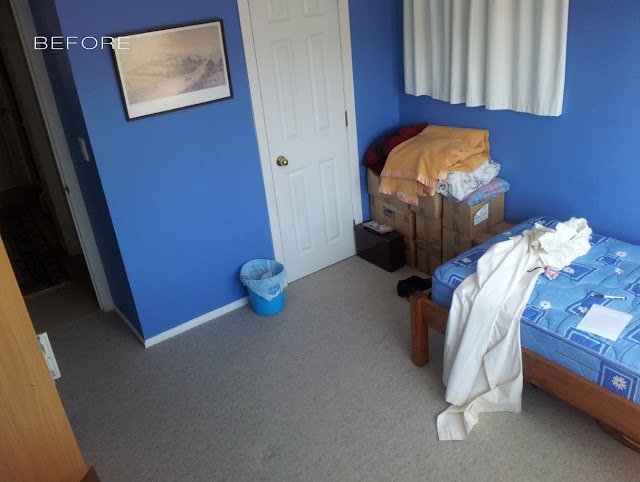
Locate an element on the screen. The width and height of the screenshot is (640, 482). door knob is located at coordinates (285, 161).